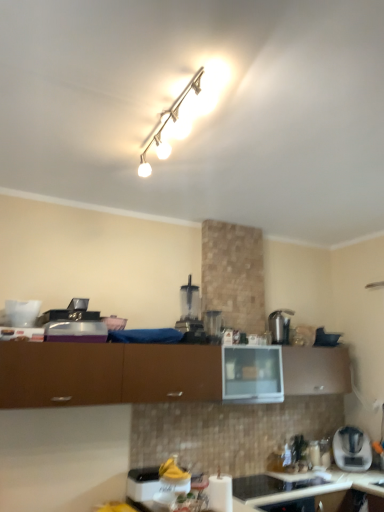
Question: From the image's perspective, is white glossy paper towel holder at lower center, the 4th appliance when ordered from top to bottom, under white glossy track light at upper center?

Choices:
 (A) no
 (B) yes

Answer: (B)

Question: Does white glossy paper towel holder at lower center, which ranks as the first appliance in bottom-to-top order, have a smaller size compared to white glossy track light at upper center?

Choices:
 (A) yes
 (B) no

Answer: (B)

Question: Is white glossy paper towel holder at lower center, the 4th appliance when ordered from top to bottom, with white glossy track light at upper center?

Choices:
 (A) yes
 (B) no

Answer: (B)

Question: Is white glossy paper towel holder at lower center, arranged as the 2th appliance when viewed from the front, positioned beyond the bounds of white glossy track light at upper center?

Choices:
 (A) yes
 (B) no

Answer: (A)

Question: Can you confirm if white glossy paper towel holder at lower center, arranged as the 2th appliance when viewed from the front, is positioned to the right of white glossy track light at upper center?

Choices:
 (A) no
 (B) yes

Answer: (B)

Question: Is white glossy paper towel holder at lower center, the 4th appliance when ordered from top to bottom, closer to the viewer compared to white glossy track light at upper center?

Choices:
 (A) no
 (B) yes

Answer: (A)

Question: Would you consider white plastic toaster at lower right to be distant from white glossy countertop at lower center?

Choices:
 (A) no
 (B) yes

Answer: (B)

Question: From a real-world perspective, is white plastic toaster at lower right located higher than white glossy countertop at lower center?

Choices:
 (A) no
 (B) yes

Answer: (B)

Question: Is white plastic toaster at lower right taller than white glossy countertop at lower center?

Choices:
 (A) no
 (B) yes

Answer: (A)

Question: Can you confirm if white plastic toaster at lower right is positioned to the left of white glossy countertop at lower center?

Choices:
 (A) no
 (B) yes

Answer: (A)

Question: Can you confirm if white plastic toaster at lower right is thinner than white glossy countertop at lower center?

Choices:
 (A) no
 (B) yes

Answer: (B)

Question: Is the surface of white plastic toaster at lower right in direct contact with white glossy countertop at lower center?

Choices:
 (A) no
 (B) yes

Answer: (A)

Question: Can brown matte cabinet at center be found inside clear plastic blender at center, acting as the first appliance starting from the top?

Choices:
 (A) yes
 (B) no

Answer: (B)